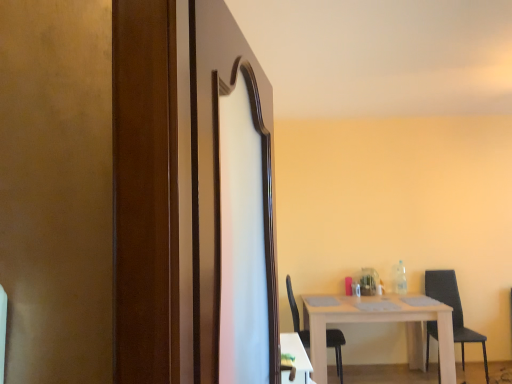
Question: Is black matte chair at lower right, the 1th chair when ordered from left to right, positioned behind wooden screen door at center?

Choices:
 (A) yes
 (B) no

Answer: (A)

Question: Is black matte chair at lower right, positioned as the second chair in right-to-left order, thinner than wooden screen door at center?

Choices:
 (A) yes
 (B) no

Answer: (B)

Question: Considering the relative sizes of black matte chair at lower right, the 1th chair when ordered from left to right, and wooden screen door at center in the image provided, is black matte chair at lower right, the 1th chair when ordered from left to right, taller than wooden screen door at center?

Choices:
 (A) yes
 (B) no

Answer: (B)

Question: Is black matte chair at lower right, the 1th chair when ordered from left to right, looking in the opposite direction of wooden screen door at center?

Choices:
 (A) no
 (B) yes

Answer: (A)

Question: Is black matte chair at lower right, positioned as the second chair in right-to-left order, positioned far away from wooden screen door at center?

Choices:
 (A) no
 (B) yes

Answer: (B)

Question: From a real-world perspective, is black matte chair at lower right, the 1th chair when ordered from left to right, positioned over wooden screen door at center based on gravity?

Choices:
 (A) yes
 (B) no

Answer: (B)

Question: Considering the relative positions of black fabric chair at right, positioned as the second chair in left-to-right order, and white wooden table at center, positioned as the 2th table in front-to-back order, in the image provided, is black fabric chair at right, positioned as the second chair in left-to-right order, to the right of white wooden table at center, positioned as the 2th table in front-to-back order, from the viewer's perspective?

Choices:
 (A) yes
 (B) no

Answer: (A)

Question: Can you confirm if black fabric chair at right, which is the 1th chair in right-to-left order, is positioned to the left of white wooden table at center, positioned as the 1th table in back-to-front order?

Choices:
 (A) no
 (B) yes

Answer: (A)

Question: From a real-world perspective, is black fabric chair at right, positioned as the second chair in left-to-right order, located higher than white wooden table at center, which is counted as the 2th table, starting from the left?

Choices:
 (A) yes
 (B) no

Answer: (A)

Question: Can you confirm if black fabric chair at right, positioned as the second chair in left-to-right order, is smaller than white wooden table at center, positioned as the 1th table in back-to-front order?

Choices:
 (A) no
 (B) yes

Answer: (B)

Question: Is black fabric chair at right, which is the 1th chair in right-to-left order, turned away from white wooden table at center, positioned as the 1th table in back-to-front order?

Choices:
 (A) no
 (B) yes

Answer: (A)

Question: Is black fabric chair at right, positioned as the second chair in left-to-right order, completely or partially outside of white wooden table at center, positioned as the 2th table in front-to-back order?

Choices:
 (A) no
 (B) yes

Answer: (B)

Question: Does white wooden table at center, positioned as the 1th table in back-to-front order, have a greater width compared to black matte chair at lower right, the 1th chair when ordered from left to right?

Choices:
 (A) yes
 (B) no

Answer: (A)